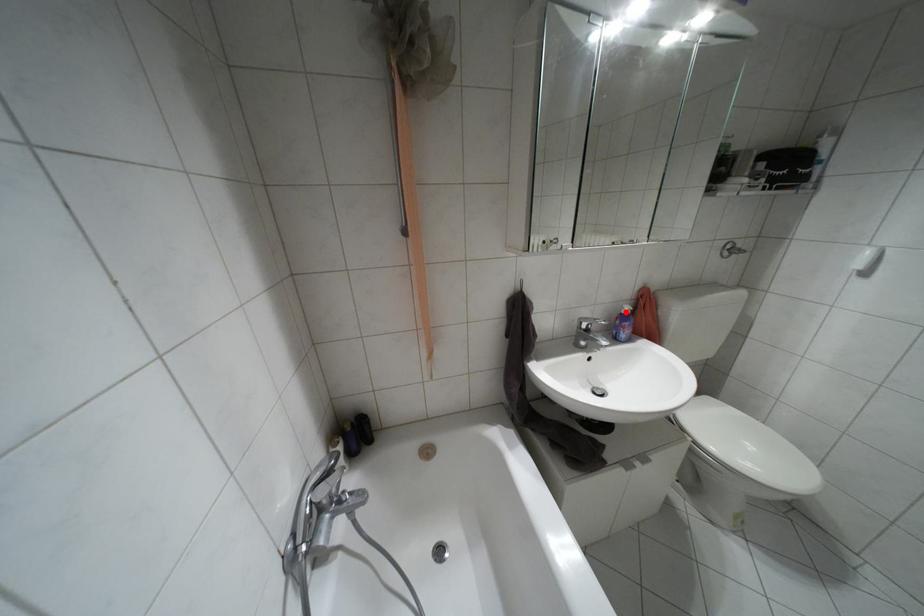
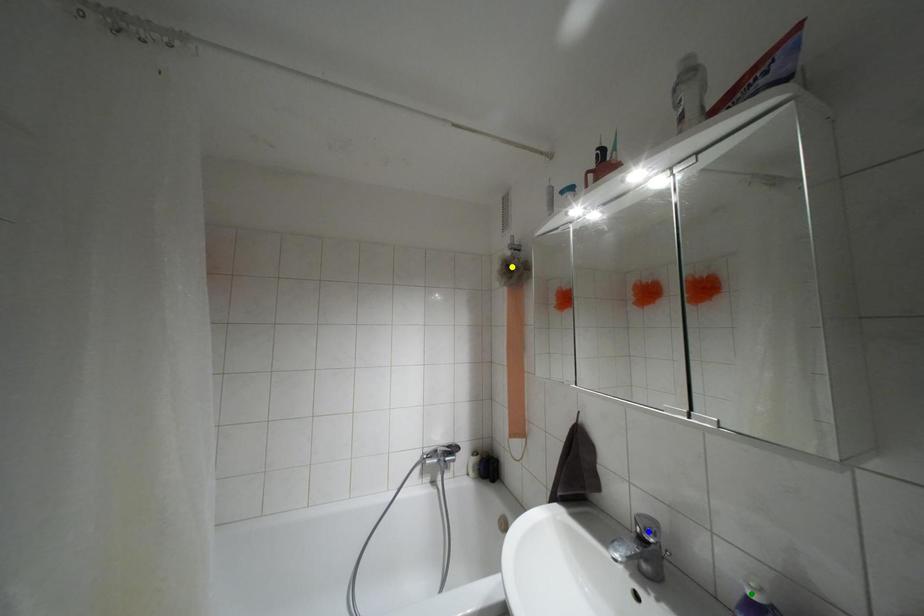
Question: I am providing you with two images of the same scene from different viewpoints. A red point is marked on the first image. You are given multiple points on the second image. Which spot in image 2 lines up with the point in image 1?

Choices:
 (A) yellow point
 (B) blue point
 (C) green point

Answer: (C)